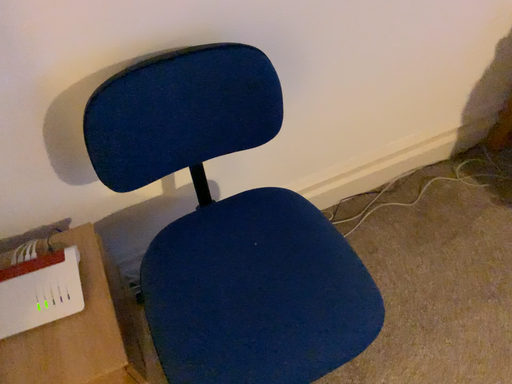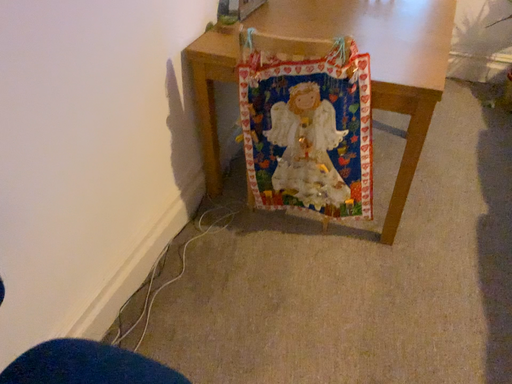
Question: How did the camera likely rotate when shooting the video?

Choices:
 (A) rotated left
 (B) rotated right

Answer: (B)